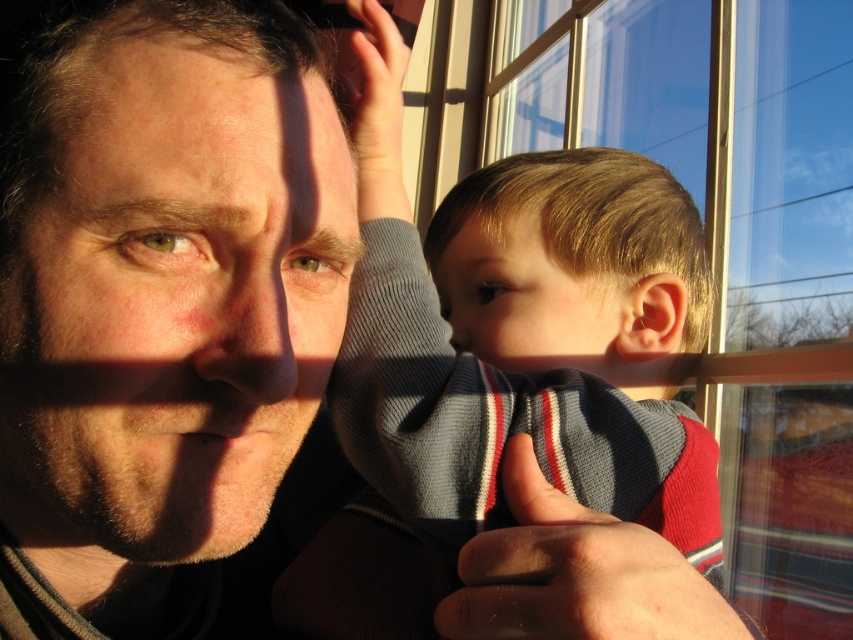
You are a photographer adjusting the lighting for a portrait. You notice the subject has a smooth skin face at center. Where should you position the main light to best highlight the subject?

The smooth skin face at center is positioned at point (x=160, y=305), so the main light should be placed slightly to the left of the face to create a flattering contour.

You are a tailor measuring the distance between the clear glass window at upper center and the striped knit sweater at center for a custom fitting. Can you confirm if the distance is more than 30 inches?

The distance between the clear glass window at upper center and the striped knit sweater at center is 30.28 inches, which is just over 30 inches. Therefore, the distance is more than 30 inches.

Looking at the scene, which object is positioned lower in the frame between the smooth skin face at center and the striped knit sweater at center?

The smooth skin face at center is located below the striped knit sweater at center, so it is positioned lower in the frame.